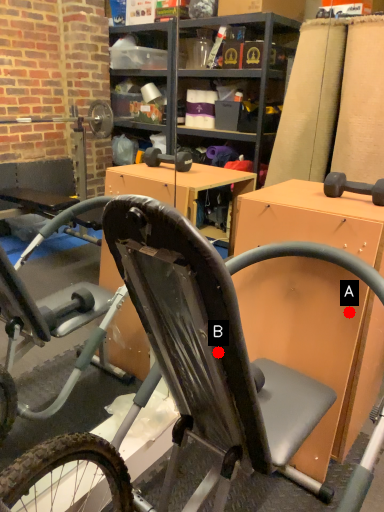
Question: Two points are circled on the image, labeled by A and B beside each circle. Which point is farther to the camera?

Choices:
 (A) A is further
 (B) B is further

Answer: (A)